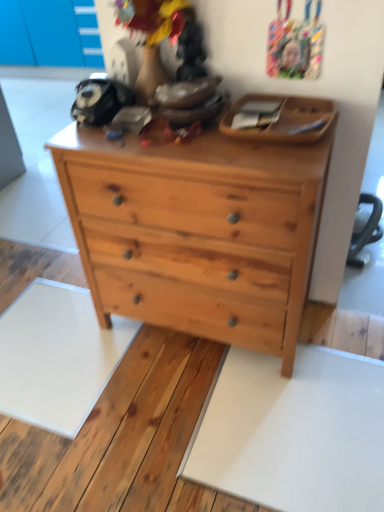
The image size is (384, 512). In order to click on vacant point above natural wood chest of drawers at center (from a real-world perspective) in this screenshot , I will do `click(190, 136)`.